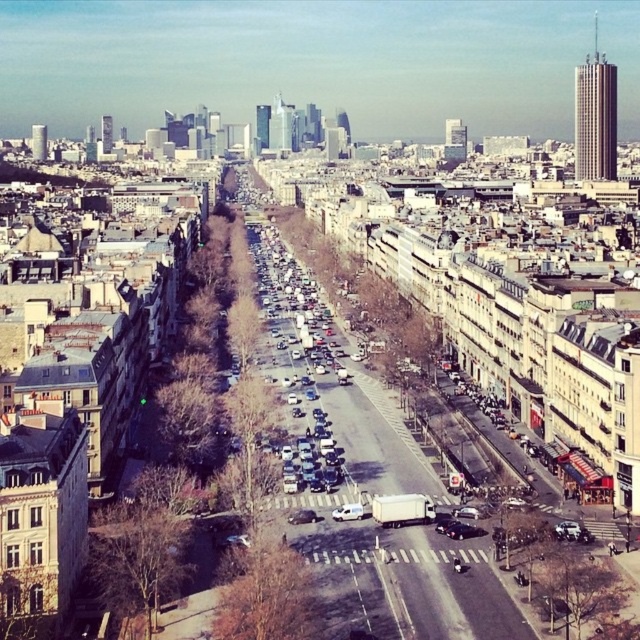
Question: Can you confirm if shiny black car at center is positioned to the left of metallic silver car at center?

Choices:
 (A) no
 (B) yes

Answer: (A)

Question: Can you confirm if white matte van at center is thinner than metallic silver car at center?

Choices:
 (A) no
 (B) yes

Answer: (A)

Question: Which point is farther from the camera taking this photo?

Choices:
 (A) 467,531
 (B) 353,506

Answer: (B)

Question: Considering the relative positions of white matte van at center and metallic silver car at center in the image provided, where is white matte van at center located with respect to metallic silver car at center?

Choices:
 (A) right
 (B) left

Answer: (A)

Question: Among these points, which one is farthest from the camera?

Choices:
 (A) (349, 515)
 (B) (458, 531)
 (C) (301, 516)

Answer: (C)

Question: Which object is closer to the camera taking this photo?

Choices:
 (A) white matte van at center
 (B) shiny black car at center

Answer: (B)